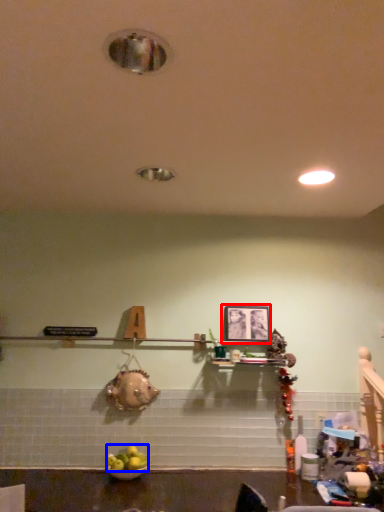
Question: Which object is closer to the camera taking this photo, picture frame (highlighted by a red box) or fruit (highlighted by a blue box)?

Choices:
 (A) picture frame
 (B) fruit

Answer: (B)